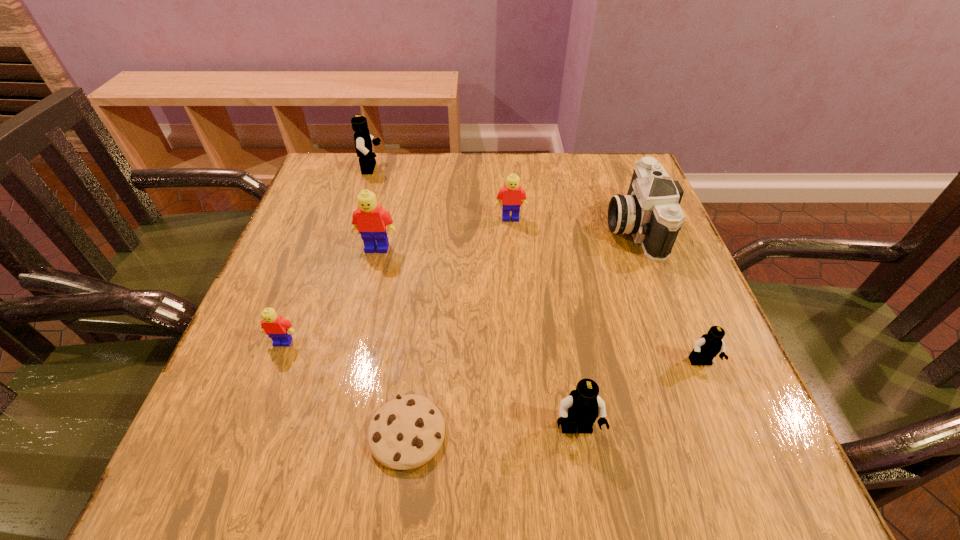
Locate an element on the screen. The width and height of the screenshot is (960, 540). vacant space at the far edge of the desktop is located at coordinates (401, 156).

Locate an element on the screen. free point at the near edge is located at coordinates (494, 451).

Where is `free space at the left edge of the desktop`? The height and width of the screenshot is (540, 960). free space at the left edge of the desktop is located at coordinates (307, 226).

The height and width of the screenshot is (540, 960). I want to click on free spot at the far right corner of the desktop, so click(626, 185).

The image size is (960, 540). I want to click on free region at the near right corner of the desktop, so click(708, 446).

You are a GUI agent. You are given a task and a screenshot of the screen. Output one action in this format:
    pyautogui.click(x=<x>, y=<y>)
    Task: Click on the empty space that is in between the nearest yellow Lego and the second smallest black Lego
    
    Given the screenshot: What is the action you would take?
    pyautogui.click(x=430, y=386)

The image size is (960, 540). Identify the location of free spot between the fourth object from right to left and the biggest yellow Lego. (444, 233).

Locate an element on the screen. The width and height of the screenshot is (960, 540). vacant area that lies between the farthest black Lego and the third nearest object is located at coordinates (536, 266).

Locate an element on the screen. The height and width of the screenshot is (540, 960). free space between the biggest yellow Lego and the camera is located at coordinates (506, 237).

Where is `unoccupied position between the farthest Lego and the nearest Lego`? unoccupied position between the farthest Lego and the nearest Lego is located at coordinates (474, 299).